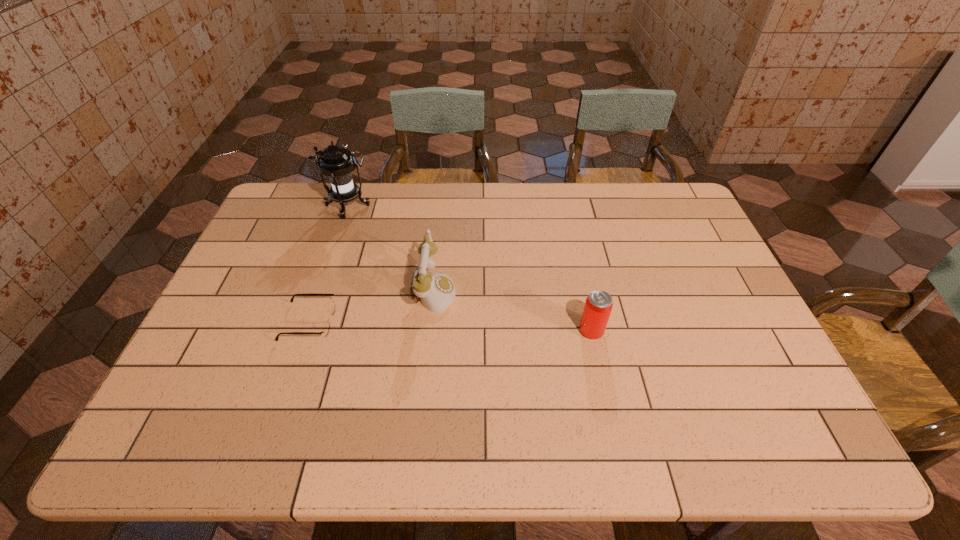
You are a GUI agent. You are given a task and a screenshot of the screen. Output one action in this format:
    pyautogui.click(x=<x>, y=<y>)
    Task: Click on the free spot between the spectacles and the telephone
    This screenshot has height=540, width=960.
    Given the screenshot: What is the action you would take?
    pyautogui.click(x=372, y=307)

Where is `vacant point located between the third tallest object and the spectacles`? This screenshot has width=960, height=540. vacant point located between the third tallest object and the spectacles is located at coordinates (451, 326).

The image size is (960, 540). Find the location of `free spot between the tallest object and the third object from left to right`. free spot between the tallest object and the third object from left to right is located at coordinates (391, 248).

Locate an element on the screen. The width and height of the screenshot is (960, 540). free spot between the second shortest object and the third shortest object is located at coordinates (513, 310).

This screenshot has width=960, height=540. What are the coordinates of `free space between the shortest object and the second shortest object` in the screenshot? It's located at coord(451,326).

Where is `empty location between the spectacles and the rightmost object`? The image size is (960, 540). empty location between the spectacles and the rightmost object is located at coordinates (x=451, y=326).

Locate an element on the screen. This screenshot has width=960, height=540. free space between the third tallest object and the second object from right to left is located at coordinates (513, 310).

The image size is (960, 540). In order to click on object that can be found as the second closest to the third object from left to right in this screenshot , I will do `click(336, 162)`.

The image size is (960, 540). Find the location of `the third closest object relative to the can`. the third closest object relative to the can is located at coordinates (336, 162).

Locate an element on the screen. free point that satisfies the following two spatial constraints: 1. on the front side of the tallest object; 2. on the right side of the rightmost object is located at coordinates 305,330.